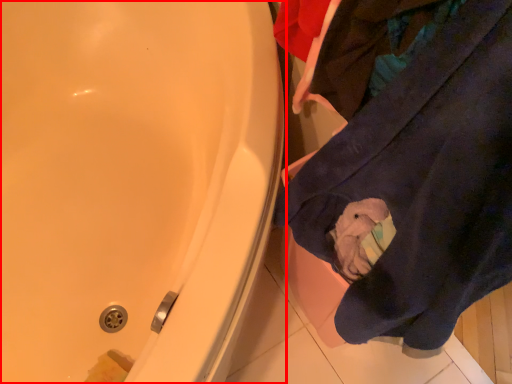
Question: Where is bathtub (annotated by the red box) located in relation to clothing in the image?

Choices:
 (A) left
 (B) right

Answer: (A)